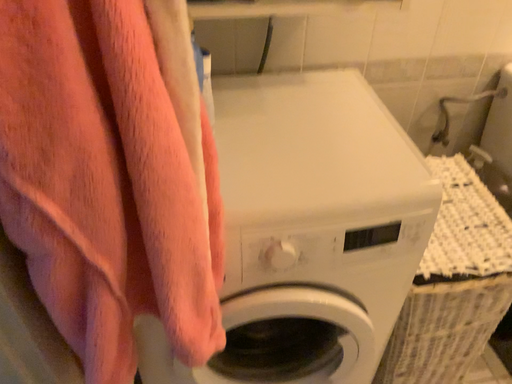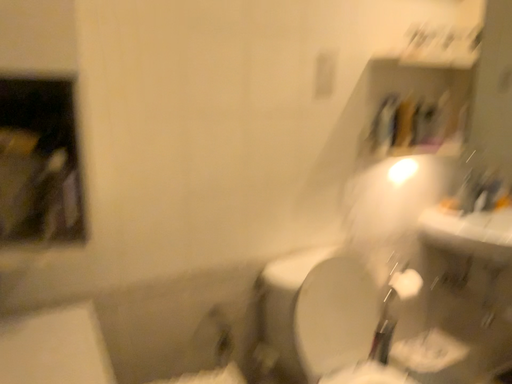
Question: How did the camera likely rotate when shooting the video?

Choices:
 (A) rotated upward
 (B) rotated downward

Answer: (A)